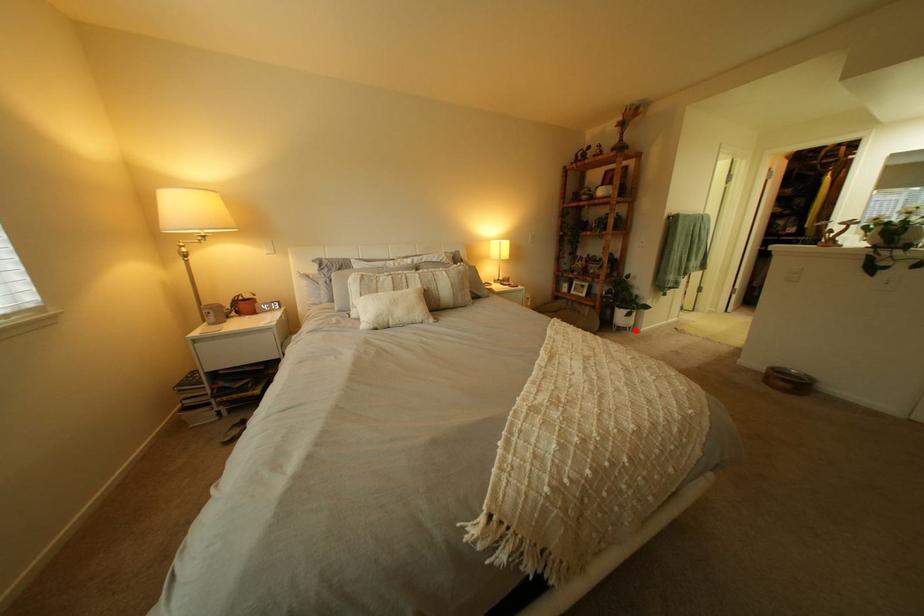
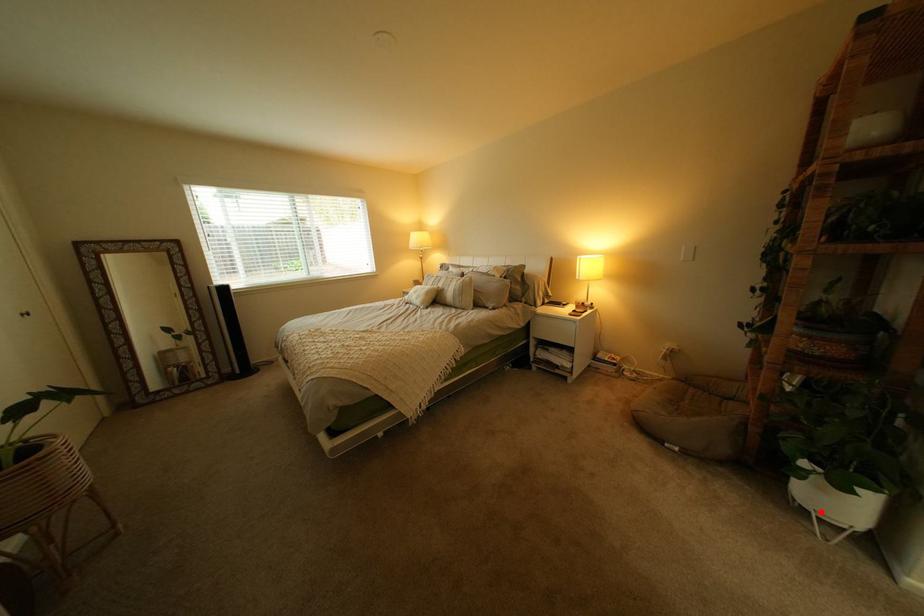
I am providing you with two images of the same scene from different viewpoints. A red point is marked on the first image and another point is marked on the second image. Is the marked point in image1 the same physical position as the marked point in image2?

Yes